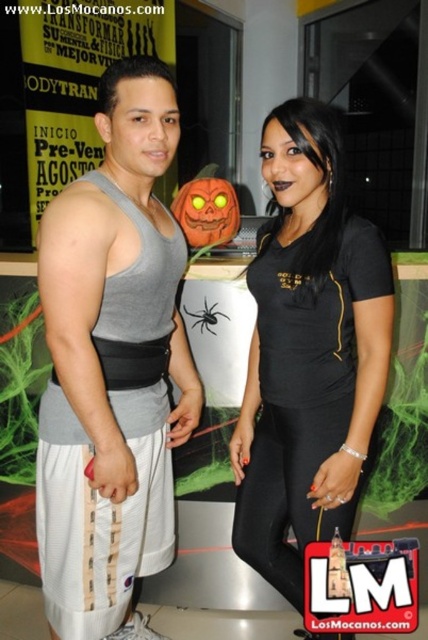
Question: Which point is farther to the camera?

Choices:
 (A) black matte spider at center
 (B) black matte shirt at center
 (C) gray fabric tank top at center

Answer: (A)

Question: Observing the image, what is the correct spatial positioning of black matte shirt at center in reference to black matte spider at center?

Choices:
 (A) above
 (B) below

Answer: (B)

Question: Observing the image, what is the correct spatial positioning of black matte shirt at center in reference to black matte spider at center?

Choices:
 (A) below
 (B) above

Answer: (A)

Question: Can you confirm if gray fabric tank top at center is wider than black matte spider at center?

Choices:
 (A) no
 (B) yes

Answer: (B)

Question: Which object appears farthest from the camera in this image?

Choices:
 (A) black matte shirt at center
 (B) black matte spider at center
 (C) gray fabric tank top at center

Answer: (B)

Question: Which of these objects is positioned farthest from the black matte shirt at center?

Choices:
 (A) black matte spider at center
 (B) gray fabric tank top at center

Answer: (A)